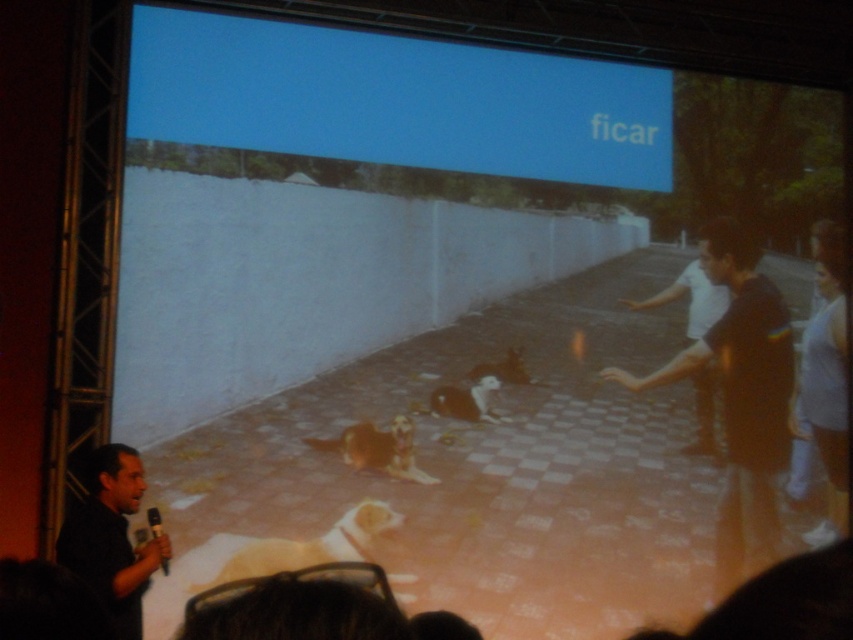
Question: Considering the real-world distances, which object is closest to the brown fur dog at center?

Choices:
 (A) white fur dog at center
 (B) blue matte projection screen at upper center
 (C) light brown fur dog at lower center
 (D) white matte wall at upper center

Answer: (A)

Question: Which object is the farthest from the white fur dog at center?

Choices:
 (A) golden fur dog at center
 (B) white matte wall at upper center
 (C) black matte shirt at lower left

Answer: (C)

Question: Can you confirm if golden fur dog at center is smaller than white fur dog at center?

Choices:
 (A) yes
 (B) no

Answer: (B)

Question: Can you confirm if blue matte projection screen at upper center is positioned above black cotton shirt at right?

Choices:
 (A) yes
 (B) no

Answer: (A)

Question: Which is nearer to the brown fur dog at center?

Choices:
 (A) black cotton shirt at right
 (B) light brown fur dog at lower center
 (C) black matte shirt at lower left
 (D) blue matte projection screen at upper center

Answer: (A)

Question: Is blue matte projection screen at upper center positioned at the back of white fur dog at center?

Choices:
 (A) no
 (B) yes

Answer: (A)